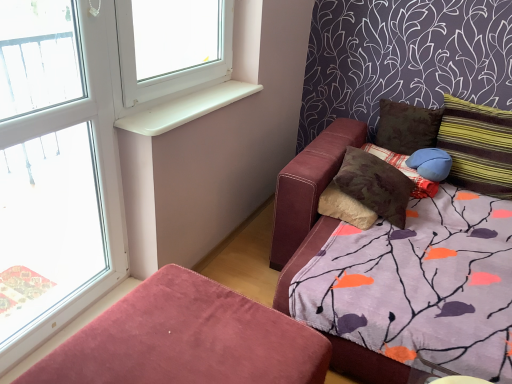
Question: Can you see clear glass window at left touching blue fabric pillow at upper right, placed as the 2th pillow when sorted from right to left?

Choices:
 (A) yes
 (B) no

Answer: (B)

Question: From the image's perspective, does clear glass window at left appear higher than blue fabric pillow at upper right, which is the third pillow in left-to-right order?

Choices:
 (A) no
 (B) yes

Answer: (A)

Question: Would you consider clear glass window at left to be distant from blue fabric pillow at upper right, which is the third pillow in left-to-right order?

Choices:
 (A) yes
 (B) no

Answer: (A)

Question: Can you confirm if clear glass window at left is thinner than blue fabric pillow at upper right, placed as the 2th pillow when sorted from right to left?

Choices:
 (A) yes
 (B) no

Answer: (A)

Question: Could you tell me if clear glass window at left is turned towards blue fabric pillow at upper right, which is the third pillow in left-to-right order?

Choices:
 (A) no
 (B) yes

Answer: (A)

Question: Does clear glass window at left appear on the left side of blue fabric pillow at upper right, which is the third pillow in left-to-right order?

Choices:
 (A) no
 (B) yes

Answer: (B)

Question: Considering the relative sizes of velvet ottoman at lower left and white plastic window sill at upper left in the image provided, is velvet ottoman at lower left taller than white plastic window sill at upper left?

Choices:
 (A) yes
 (B) no

Answer: (A)

Question: Is velvet ottoman at lower left thinner than white plastic window sill at upper left?

Choices:
 (A) no
 (B) yes

Answer: (A)

Question: Is the depth of velvet ottoman at lower left greater than that of white plastic window sill at upper left?

Choices:
 (A) yes
 (B) no

Answer: (B)

Question: Does velvet ottoman at lower left have a lesser height compared to white plastic window sill at upper left?

Choices:
 (A) yes
 (B) no

Answer: (B)

Question: Does velvet ottoman at lower left have a smaller size compared to white plastic window sill at upper left?

Choices:
 (A) yes
 (B) no

Answer: (B)

Question: Are velvet ottoman at lower left and white plastic window sill at upper left far apart?

Choices:
 (A) yes
 (B) no

Answer: (B)

Question: Can you confirm if white plastic window sill at upper left is wider than clear glass window at left?

Choices:
 (A) yes
 (B) no

Answer: (A)